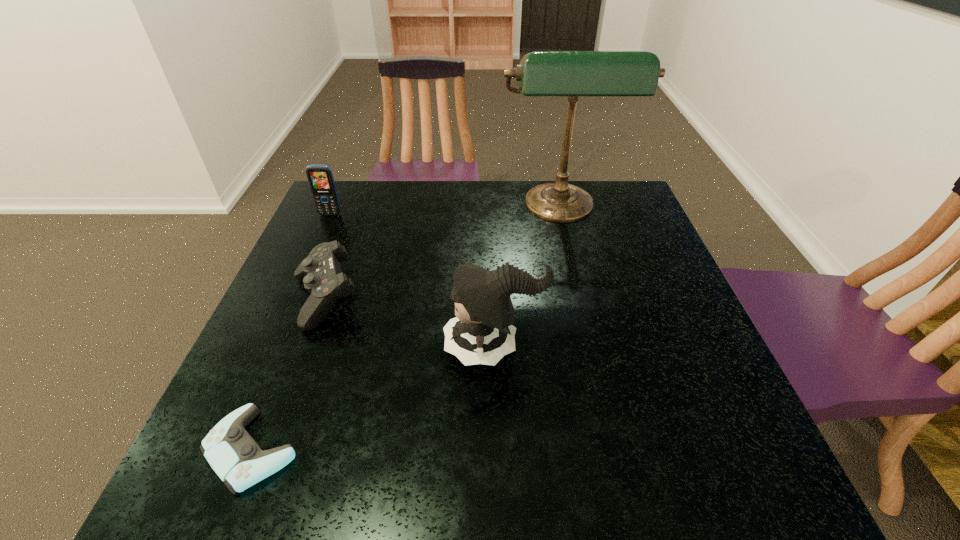
Select which object appears as the fourth closest to the fourth shortest object. Please provide its 2D coordinates. Your answer should be formatted as a tuple, i.e. [(x, y)], where the tuple contains the x and y coordinates of a point satisfying the conditions above.

[(320, 177)]

Find the location of `free space that satisfies the following two spatial constraints: 1. at the face of the second tallest object; 2. on the front side of the nearer control`. free space that satisfies the following two spatial constraints: 1. at the face of the second tallest object; 2. on the front side of the nearer control is located at coordinates (497, 449).

What are the coordinates of `vacant space that satisfies the following two spatial constraints: 1. on the screen of the cellular telephone; 2. on the left side of the taller control` in the screenshot? It's located at (292, 300).

Where is `free space that satisfies the following two spatial constraints: 1. at the face of the second tallest object; 2. on the front side of the nearest object`? free space that satisfies the following two spatial constraints: 1. at the face of the second tallest object; 2. on the front side of the nearest object is located at coordinates (497, 449).